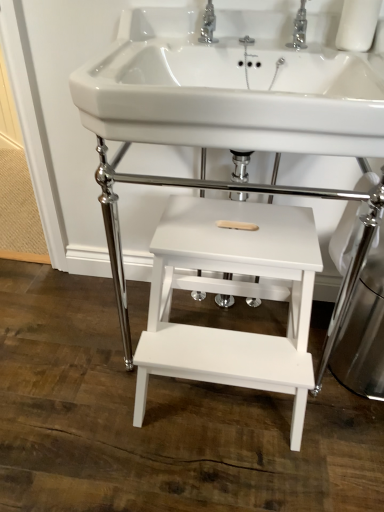
Question: Is white glossy sink at center a part of white matte wood step stool at center, which is the second table in bottom-to-top order?

Choices:
 (A) no
 (B) yes

Answer: (A)

Question: Does white matte wood step stool at center, which is the 1th table from top to bottom, have a lesser height compared to white glossy sink at center?

Choices:
 (A) no
 (B) yes

Answer: (A)

Question: Considering the relative sizes of white matte wood step stool at center, which is the second table in bottom-to-top order, and white glossy sink at center in the image provided, is white matte wood step stool at center, which is the second table in bottom-to-top order, smaller than white glossy sink at center?

Choices:
 (A) no
 (B) yes

Answer: (A)

Question: Is white matte wood step stool at center, which is the second table in bottom-to-top order, oriented towards white glossy sink at center?

Choices:
 (A) yes
 (B) no

Answer: (B)

Question: From a real-world perspective, is white matte wood step stool at center, which is the second table in bottom-to-top order, located higher than white glossy sink at center?

Choices:
 (A) yes
 (B) no

Answer: (B)

Question: Looking at the image, does white wood step stool at center, the second table when ordered from top to bottom, seem bigger or smaller compared to white matte wood step stool at center, which is the 1th table from top to bottom?

Choices:
 (A) small
 (B) big

Answer: (A)

Question: Considering the positions of point click(193, 226) and point click(331, 344), is point click(193, 226) closer or farther from the camera than point click(331, 344)?

Choices:
 (A) closer
 (B) farther

Answer: (A)

Question: Would you say white wood step stool at center, which appears as the first table when ordered from the bottom, is to the left or to the right of white matte wood step stool at center, which is the 1th table from top to bottom, in the picture?

Choices:
 (A) right
 (B) left

Answer: (B)

Question: From the image's perspective, is white wood step stool at center, the second table when ordered from top to bottom, positioned above or below white matte wood step stool at center, which is the second table in bottom-to-top order?

Choices:
 (A) above
 (B) below

Answer: (B)

Question: Does point (125, 314) appear closer or farther from the camera than point (205, 28)?

Choices:
 (A) closer
 (B) farther

Answer: (B)

Question: Based on their sizes in the image, would you say white matte wood step stool at center, which is the 1th table from top to bottom, is bigger or smaller than polished chrome tap at upper center, the 2th tap when ordered from right to left?

Choices:
 (A) big
 (B) small

Answer: (A)

Question: From the image's perspective, is white matte wood step stool at center, which is the second table in bottom-to-top order, positioned above or below polished chrome tap at upper center, arranged as the 1th tap when viewed from the left?

Choices:
 (A) below
 (B) above

Answer: (A)

Question: Which is correct: white matte wood step stool at center, which is the second table in bottom-to-top order, is inside polished chrome tap at upper center, the 2th tap when ordered from right to left, or outside of it?

Choices:
 (A) outside
 (B) inside

Answer: (A)

Question: Is point (286, 105) positioned closer to the camera than point (246, 182)?

Choices:
 (A) farther
 (B) closer

Answer: (B)

Question: From a real-world perspective, relative to white matte wood step stool at center, which is the 1th table from top to bottom, is white glossy sink at center vertically above or below?

Choices:
 (A) below
 (B) above

Answer: (B)